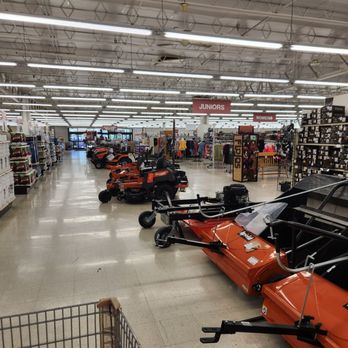
Locate an element on the screen. support pole is located at coordinates (172, 151).